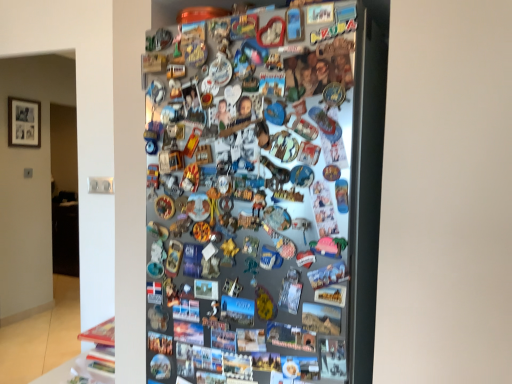
Measure the distance between point [27,125] and camera.

Point [27,125] and camera are 12.75 feet apart.

What do you see at coordinates (24, 123) in the screenshot? I see `matte black picture frame at upper left` at bounding box center [24, 123].

Where is `matte black picture frame at upper left`? matte black picture frame at upper left is located at coordinates (24, 123).

Find the location of a particular element. matte black picture frame at upper left is located at coordinates (24, 123).